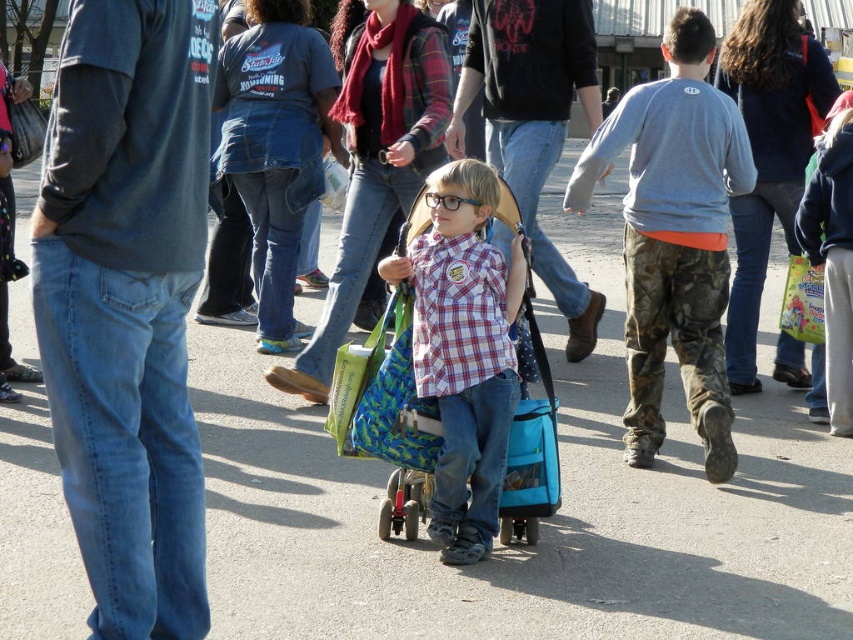
You are standing at the center of the scene and want to move to the camouflage pants at right. Which direction should you move in to reach them?

The camouflage pants at right are located at point 0.372 on the x axis and 0.791 on the y axis. Since you are at the center, moving right along the x axis and slightly up along the y axis will get you there.

You are a photographer trying to capture a clear shot of the plaid cotton shirt at center and the camouflage pants at right. Since you want both subjects in focus, which one should you adjust your camera focus on first?

The plaid cotton shirt at center is behind the camouflage pants at right, so you should focus on the camouflage pants at right first to ensure both are in focus.

You are a photographer trying to capture a photo of the plaid cotton shirt at center and the camouflage pants at right. Which object should you focus on first if you want to ensure both are in the frame without moving the camera?

You should focus on the plaid cotton shirt at center first because the camouflage pants at right is much taller, so adjusting the camera angle to include the taller camouflage pants at right would naturally include the plaid cotton shirt at center in the frame.